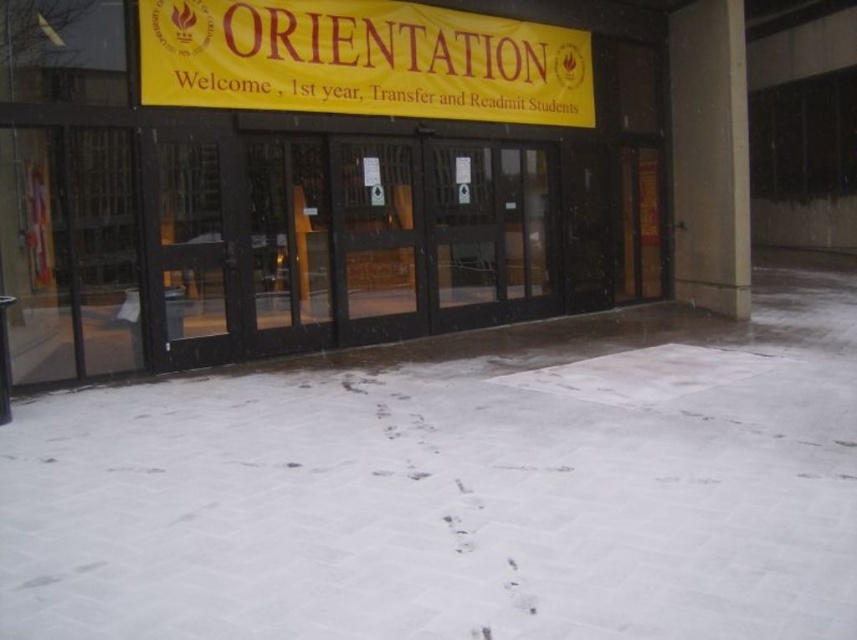
Where is `black glass doors at center`? black glass doors at center is located at coordinates (316, 189).

Does point (114, 51) come behind point (318, 61)?

No.

Where is `black glass doors at center`? This screenshot has width=857, height=640. black glass doors at center is located at coordinates [x=316, y=189].

Is white powdery snow at center smaller than yellow/yellowish paper at upper center?

No.

Can you confirm if white powdery snow at center is taller than yellow/yellowish paper at upper center?

Yes.

Is point (376, 628) in front of point (553, 61)?

Yes.

Where is `white powdery snow at center`? white powdery snow at center is located at coordinates (458, 484).

Can you confirm if white powdery snow at center is positioned above black glass doors at center?

No.

In the scene shown: Which is below, white powdery snow at center or black glass doors at center?

Positioned lower is white powdery snow at center.

Is point (506, 563) positioned before point (232, 340)?

Yes, it is.

Where is `white powdery snow at center`? The height and width of the screenshot is (640, 857). white powdery snow at center is located at coordinates (458, 484).